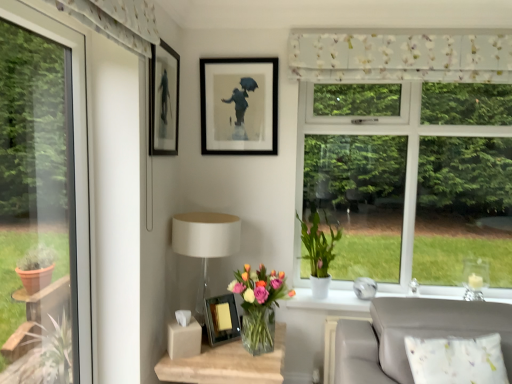
Identify the location of vacant area situated below translucent glass vase at lower center, arranged as the 1th houseplant when viewed from the front (from a real-world perspective). (259, 351).